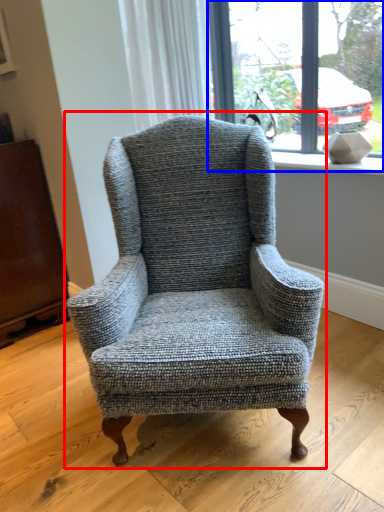
Question: Which object is closer to the camera taking this photo, chair (highlighted by a red box) or window (highlighted by a blue box)?

Choices:
 (A) chair
 (B) window

Answer: (A)